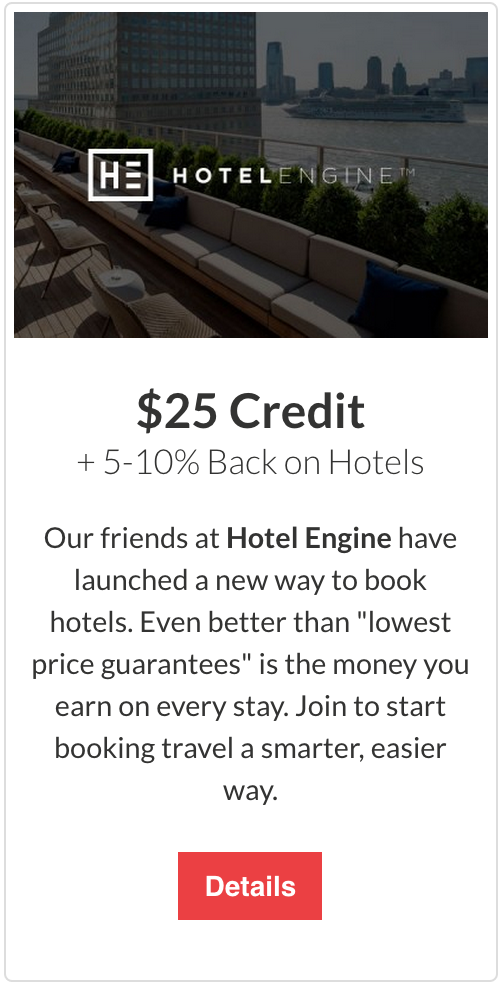
The height and width of the screenshot is (988, 500). Identify the location of sofa. (264, 270).